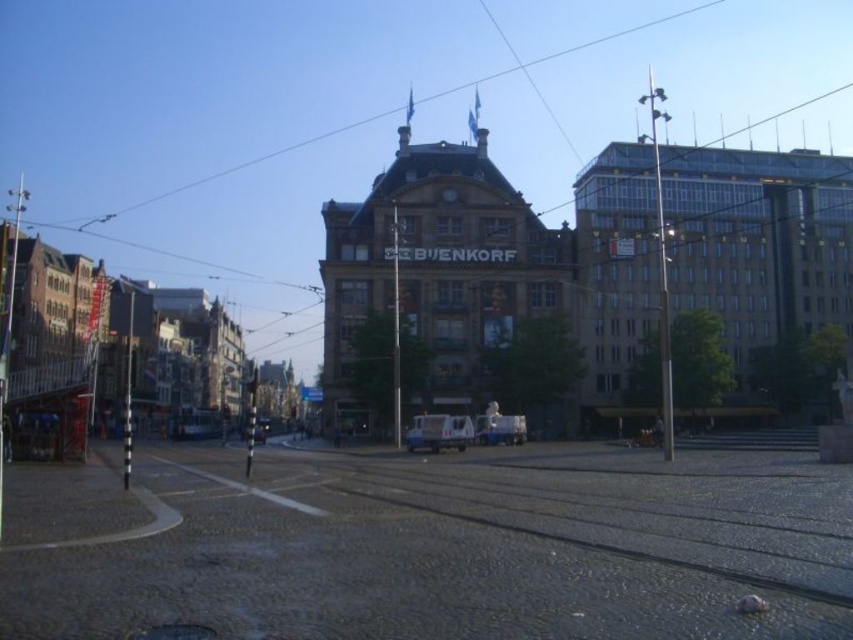
Who is positioned more to the right, metallic silver van at center or white matte van at center?

white matte van at center

Who is more forward, [442,429] or [519,435]?

Point [442,429] is in front.

Between point (431, 428) and point (514, 433), which one is positioned behind?

Positioned behind is point (514, 433).

You are a GUI agent. You are given a task and a screenshot of the screen. Output one action in this format:
    pyautogui.click(x=<x>, y=<y>)
    Task: Click on the metallic silver van at center
    
    Given the screenshot: What is the action you would take?
    pyautogui.click(x=439, y=432)

Find the location of a particular element. The height and width of the screenshot is (640, 853). white matte van at center is located at coordinates (500, 428).

Is point (515, 442) positioned before point (254, 442)?

Yes, point (515, 442) is closer to viewer.

Locate an element on the screen. This screenshot has height=640, width=853. white matte van at center is located at coordinates (500, 428).

Is point (432, 444) closer to camera compared to point (248, 433)?

Yes, it is.

Consider the image. Who is more distant from viewer, (419,440) or (244,436)?

Positioned behind is point (244,436).

Locate an element on the screen. metallic silver van at center is located at coordinates (439, 432).